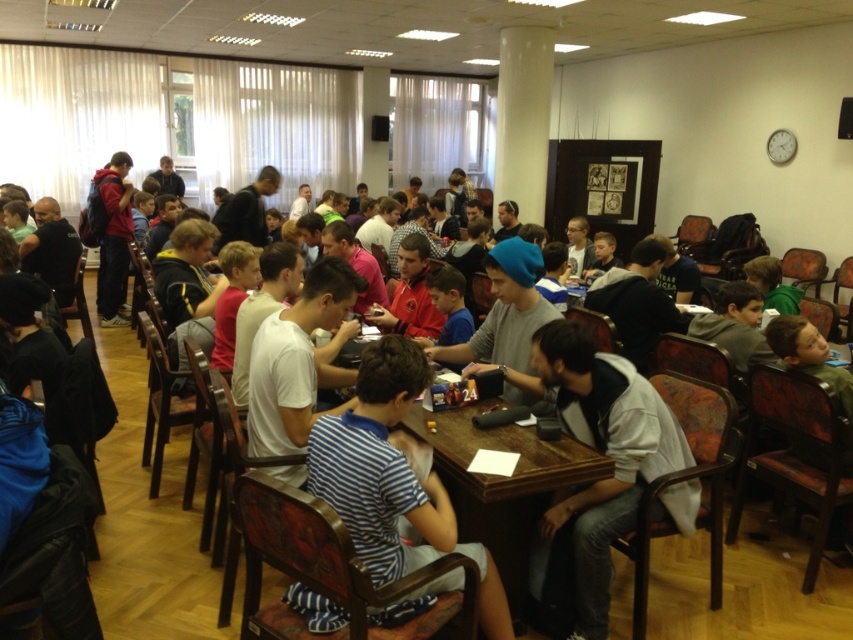
Can you confirm if white fleece jacket at center is smaller than wooden table at center?

Correct, white fleece jacket at center occupies less space than wooden table at center.

Is point (589, 330) closer to viewer compared to point (491, 624)?

No, (589, 330) is behind (491, 624).

Locate an element on the screen. This screenshot has height=640, width=853. white fleece jacket at center is located at coordinates (602, 452).